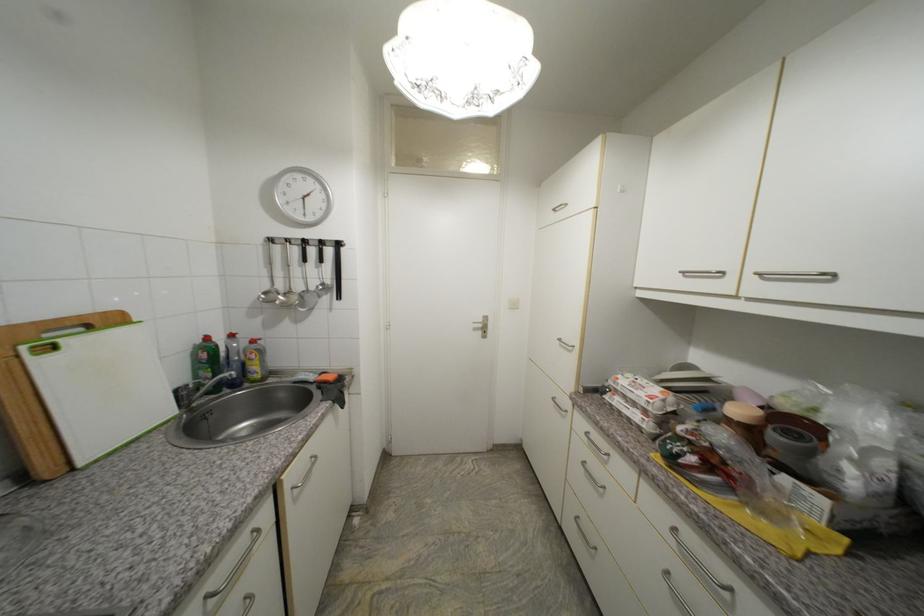
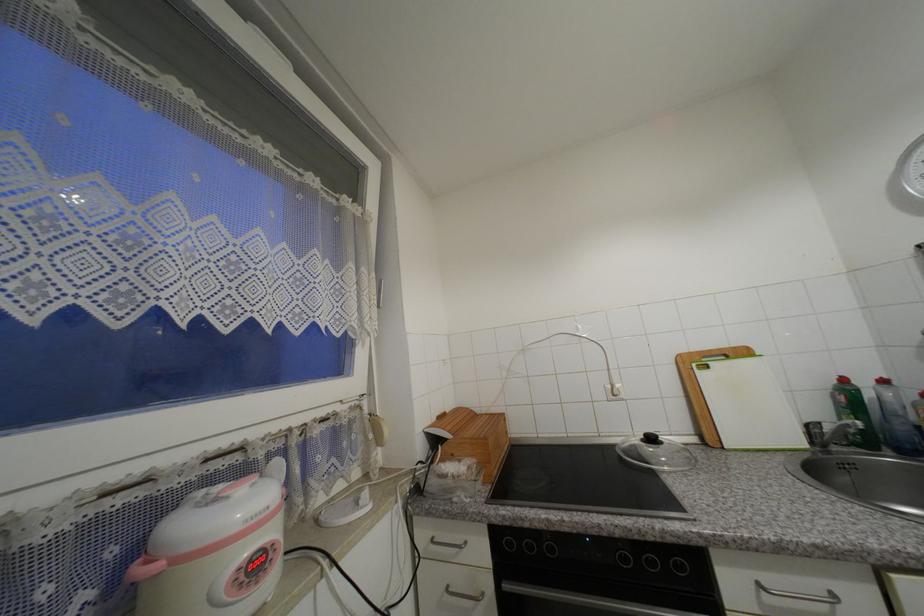
In the second image, find the point that corresponds to pixel 261 533 in the first image.

(840, 597)